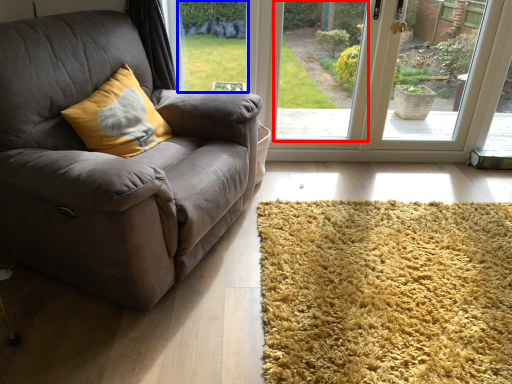
Question: Which object is closer to the camera taking this photo, window screen (highlighted by a red box) or window screen (highlighted by a blue box)?

Choices:
 (A) window screen
 (B) window screen

Answer: (A)